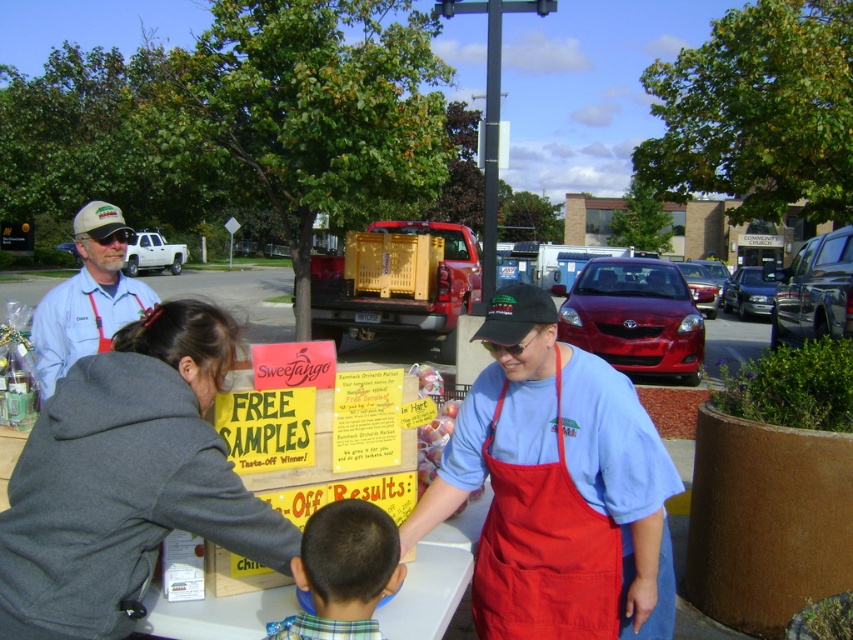
Question: Which point is farther to the camera?

Choices:
 (A) (73, 312)
 (B) (515, 605)
 (C) (334, 584)
 (D) (207, 440)

Answer: (A)

Question: Which of the following is the farthest from the observer?

Choices:
 (A) matte blue shirt at upper left
 (B) plaid shirt at lower center

Answer: (A)

Question: Does gray fleece sweatshirt at center appear on the right side of matte blue shirt at upper left?

Choices:
 (A) yes
 (B) no

Answer: (A)

Question: Can you confirm if gray fleece sweatshirt at center is positioned below matte blue shirt at upper left?

Choices:
 (A) no
 (B) yes

Answer: (B)

Question: Estimate the real-world distances between objects in this image. Which object is closer to the matte blue shirt at center?

Choices:
 (A) matte blue shirt at upper left
 (B) red fabric apron at center
 (C) plaid shirt at lower center

Answer: (B)

Question: Does matte blue shirt at center appear over plaid shirt at lower center?

Choices:
 (A) no
 (B) yes

Answer: (B)